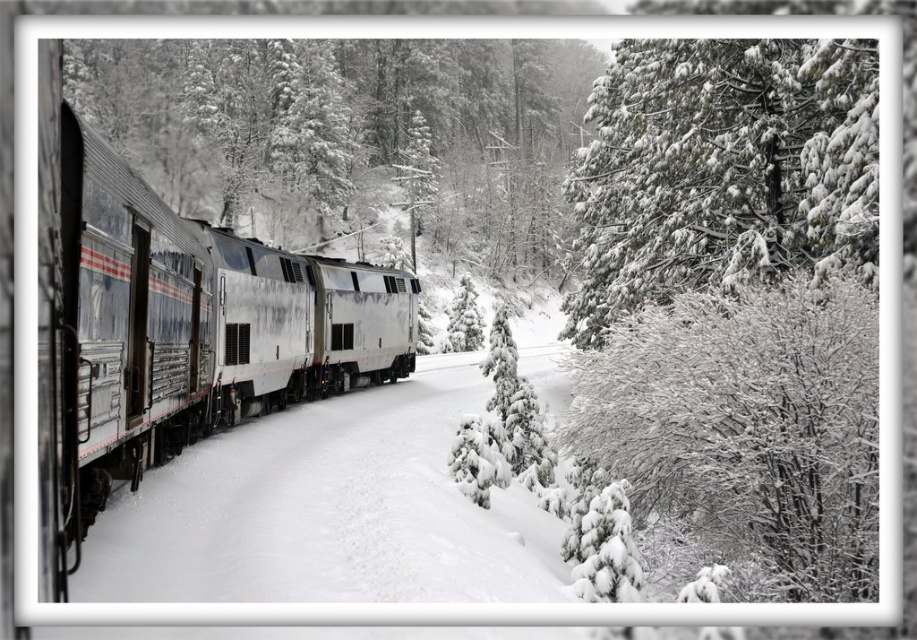
Question: Among these objects, which one is farthest from the camera?

Choices:
 (A) silver metallic locomotive at center
 (B) snow-covered evergreen at upper right
 (C) snow-covered pine tree at left

Answer: (C)

Question: Is silver metallic train at left bigger than white fluffy snow at center?

Choices:
 (A) no
 (B) yes

Answer: (B)

Question: Which object is closer to the camera taking this photo?

Choices:
 (A) silver metallic train at left
 (B) snow-covered pine tree at left
 (C) silver metallic locomotive at center

Answer: (A)

Question: Is white fluffy snow at center positioned behind silver metallic locomotive at center?

Choices:
 (A) yes
 (B) no

Answer: (B)

Question: Which point is farther to the camera?

Choices:
 (A) (399, 278)
 (B) (672, 51)
 (C) (94, 412)

Answer: (A)

Question: Does white fluffy snow at center have a greater width compared to silver metallic locomotive at center?

Choices:
 (A) yes
 (B) no

Answer: (A)